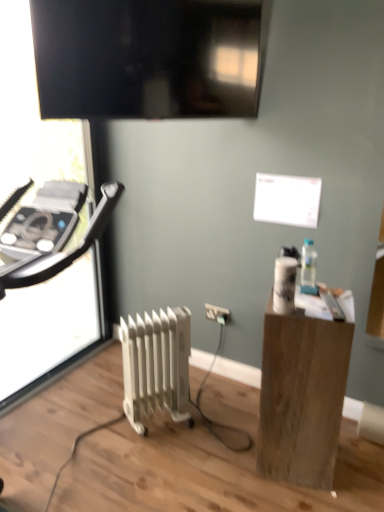
Find the location of `free space in front of wooden block at right`. free space in front of wooden block at right is located at coordinates (300, 499).